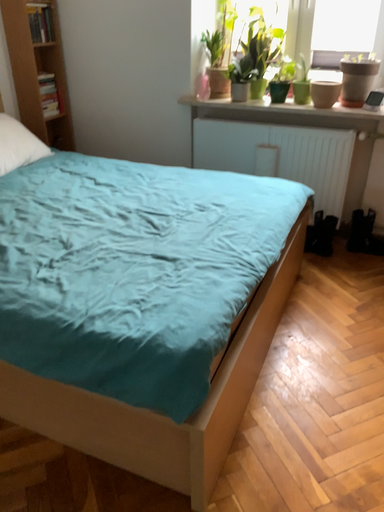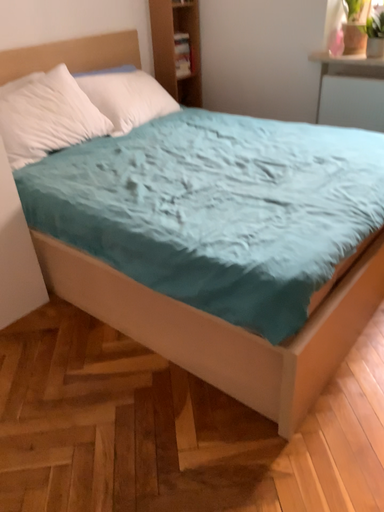
Question: Which way did the camera rotate in the video?

Choices:
 (A) rotated right
 (B) rotated left

Answer: (B)